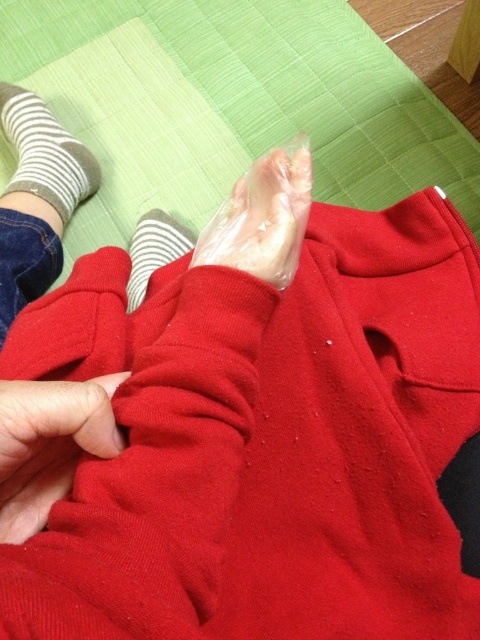
You are a physical therapist working with a patient who has a foot injury. The patient is lying on a green quilted futon. You need to place a new bandage on the transparent plastic foot at center. According to the image, where exactly should you place the bandage?

The transparent plastic foot at center is located at point [263,218], so you should place the bandage at that exact coordinate to ensure proper alignment and coverage.

You are a nurse checking on a patient. You see the transparent plastic foot at center and the white striped sock at lower left. Which object is nearer to you?

The transparent plastic foot at center is closer to the viewer than the white striped sock at lower left.

You are a physical therapist examining a patient. You need to place a heating pad on the transparent plastic foot at center. Where should you place the heating pad?

Place the heating pad at the location corresponding to the 2D coordinates point (263, 218) where the transparent plastic foot at center is located.